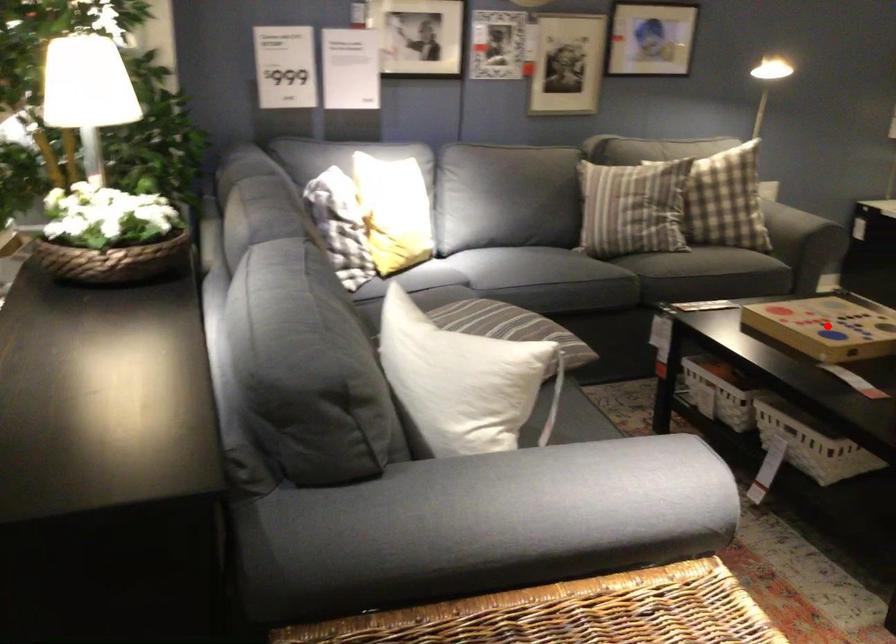
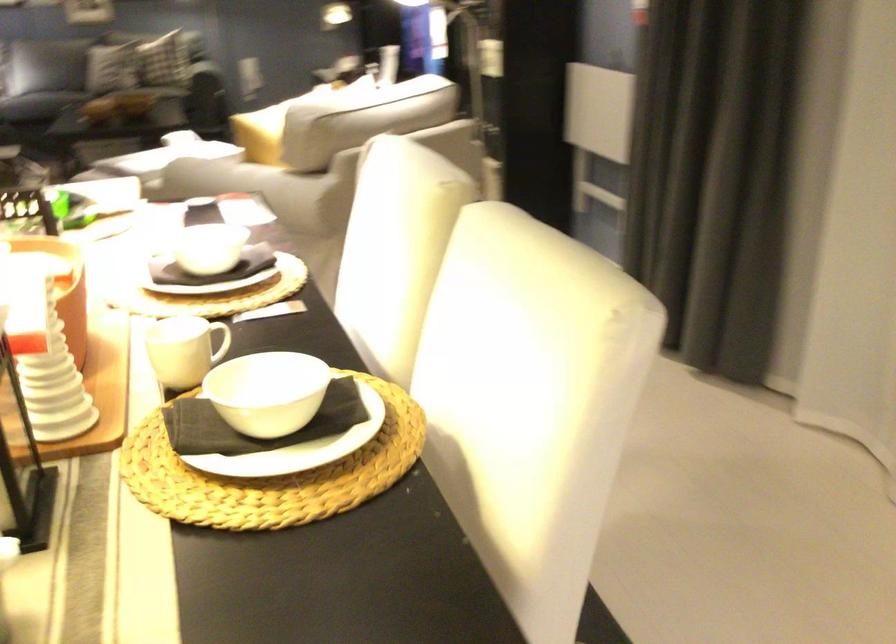
Question: I am providing you with two images of the same scene from different viewpoints. A red point is marked on the first image. At the location where the point appears in image 1, is it still visible in image 2?

Choices:
 (A) Yes
 (B) No

Answer: (B)